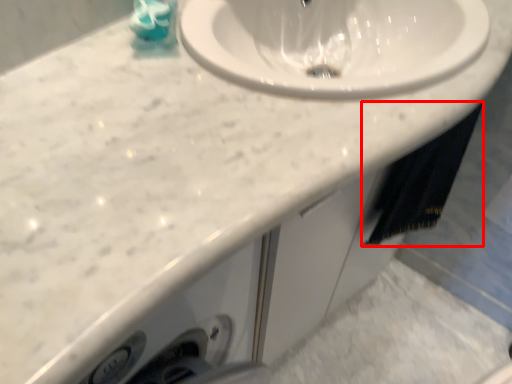
Question: From the image, what is the correct spatial relationship of bath towel (annotated by the red box) in relation to liquid?

Choices:
 (A) left
 (B) right

Answer: (B)